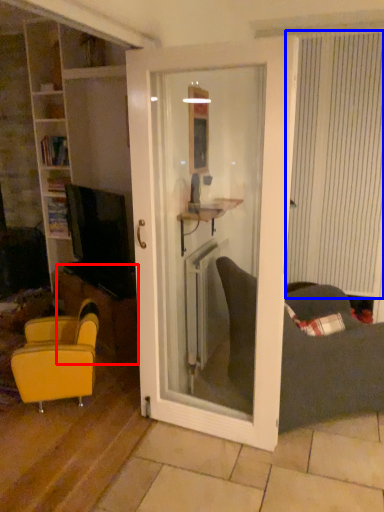
Question: Which object is further to the camera taking this photo, table (highlighted by a red box) or curtain (highlighted by a blue box)?

Choices:
 (A) table
 (B) curtain

Answer: (A)